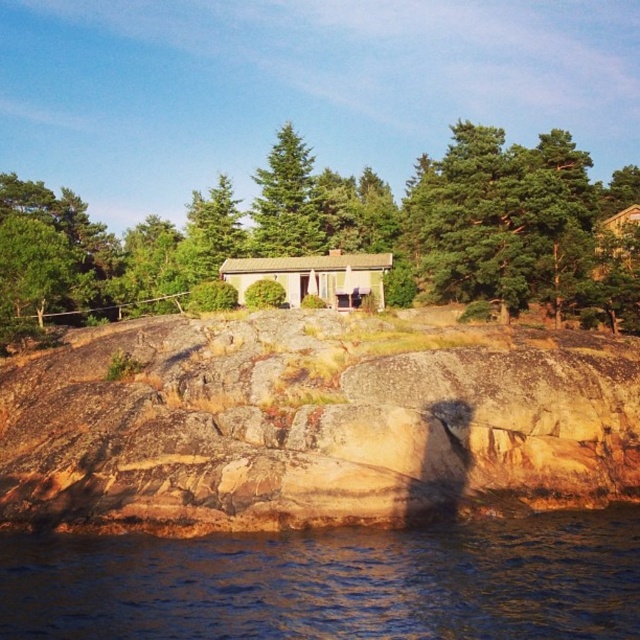
Which is below, blue water at lower left or light brown wooden cottage at center?

blue water at lower left is lower down.

You are a GUI agent. You are given a task and a screenshot of the screen. Output one action in this format:
    pyautogui.click(x=<x>, y=<y>)
    Task: Click on the blue water at lower left
    
    Given the screenshot: What is the action you would take?
    pyautogui.click(x=333, y=582)

Between point (380, 580) and point (618, 248), which one is positioned behind?

Positioned behind is point (618, 248).

Who is more distant from viewer, [632,570] or [634,204]?

The point [634,204] is more distant.

You are a GUI agent. You are given a task and a screenshot of the screen. Output one action in this format:
    pyautogui.click(x=<x>, y=<y>)
    Task: Click on the blue water at lower left
    Image resolution: width=640 pixels, height=640 pixels.
    Given the screenshot: What is the action you would take?
    pyautogui.click(x=333, y=582)

Between brown rough rock at center and wooden cabin at upper center, which one appears on the left side from the viewer's perspective?

Positioned to the left is brown rough rock at center.

Can you confirm if brown rough rock at center is shorter than wooden cabin at upper center?

No.

Is point (353, 426) positioned after point (604, 243)?

No, it is not.

This screenshot has width=640, height=640. What are the coordinates of `brown rough rock at center` in the screenshot? It's located at (314, 424).